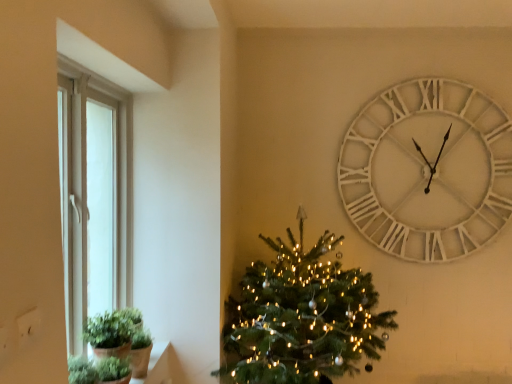
Question: Is white wooden clock at upper right completely or partially inside green matte plant at lower left?

Choices:
 (A) no
 (B) yes

Answer: (A)

Question: Considering the relative sizes of green matte plant at lower left and white wooden clock at upper right in the image provided, is green matte plant at lower left bigger than white wooden clock at upper right?

Choices:
 (A) no
 (B) yes

Answer: (A)

Question: Can you confirm if green matte plant at lower left is wider than white wooden clock at upper right?

Choices:
 (A) no
 (B) yes

Answer: (B)

Question: Is green matte plant at lower left thinner than white wooden clock at upper right?

Choices:
 (A) yes
 (B) no

Answer: (B)

Question: Is green matte plant at lower left smaller than white wooden clock at upper right?

Choices:
 (A) no
 (B) yes

Answer: (B)

Question: Is green matte plant at lower left further to the viewer compared to white wooden clock at upper right?

Choices:
 (A) yes
 (B) no

Answer: (B)

Question: From a real-world perspective, is white wooden clock at upper right positioned under green matte christmas tree at center based on gravity?

Choices:
 (A) no
 (B) yes

Answer: (A)

Question: From a real-world perspective, is white wooden clock at upper right located higher than green matte christmas tree at center?

Choices:
 (A) no
 (B) yes

Answer: (B)

Question: From the image's perspective, is white wooden clock at upper right over green matte christmas tree at center?

Choices:
 (A) yes
 (B) no

Answer: (A)

Question: Can you confirm if white wooden clock at upper right is shorter than green matte christmas tree at center?

Choices:
 (A) no
 (B) yes

Answer: (B)

Question: Is white wooden clock at upper right positioned beyond the bounds of green matte christmas tree at center?

Choices:
 (A) yes
 (B) no

Answer: (A)

Question: Is white wooden clock at upper right in contact with green matte christmas tree at center?

Choices:
 (A) yes
 (B) no

Answer: (B)

Question: Are green matte plant at lower left and green matte plant at lower left far apart?

Choices:
 (A) no
 (B) yes

Answer: (A)